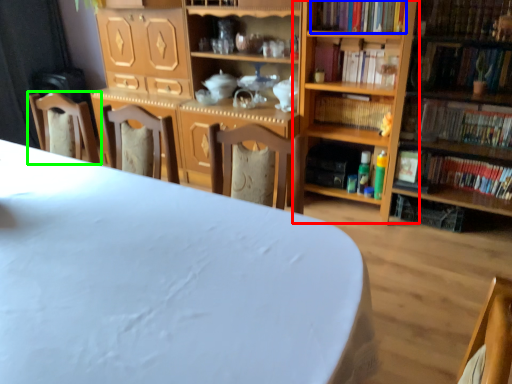
Question: Considering the real-world distances, which object is closest to shelf (highlighted by a red box)? book (highlighted by a blue box) or chair (highlighted by a green box).

Choices:
 (A) book
 (B) chair

Answer: (A)